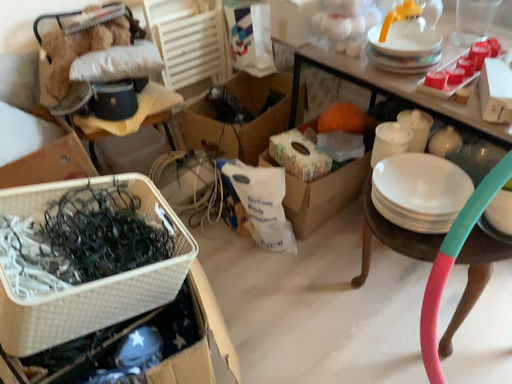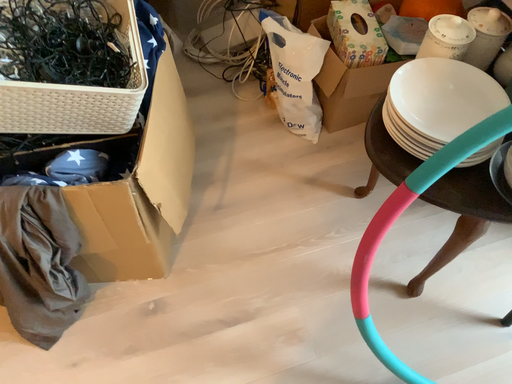
Question: How did the camera likely rotate when shooting the video?

Choices:
 (A) rotated right
 (B) rotated left

Answer: (B)